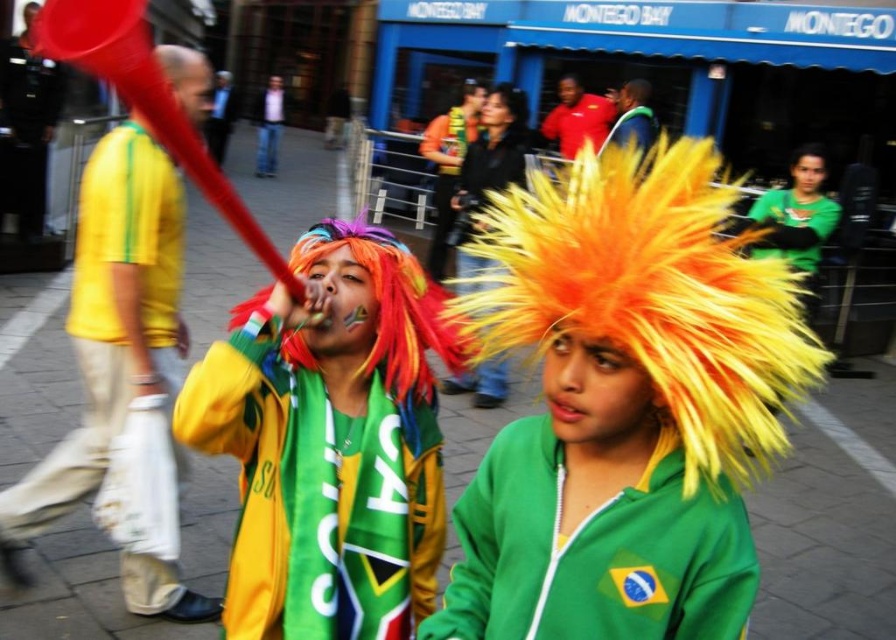
You are a photographer trying to capture a candid shot of the green fabric jacket at center and the matte black camera at center. Since you want to ensure both subjects are in focus, you need to know their heights. Which object is shorter?

The green fabric jacket at center is shorter than the matte black camera at center.

You are a photographer trying to capture a group photo of the multicolored wig at center and the yellow matte shirt at left. Since you want to ensure both subjects are fully visible, which subject should you position closer to the camera to avoid cropping?

The multicolored wig at center has a smaller width than the yellow matte shirt at left, so positioning the multicolored wig at center closer to the camera will ensure both are fully visible without cropping.

You are a photographer trying to capture the shiny black hair at center and the matte black camera at center in the same frame. However, you notice that one of them is blocking the other. Which object is blocking the other?

The shiny black hair at center is blocking the matte black camera at center because it is positioned in front of it.